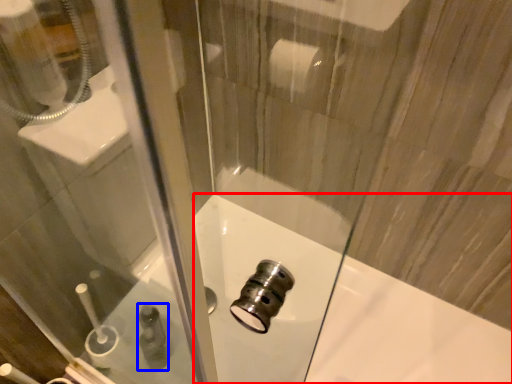
Question: Which object is further to the camera taking this photo, bath (highlighted by a red box) or toiletry (highlighted by a blue box)?

Choices:
 (A) bath
 (B) toiletry

Answer: (B)